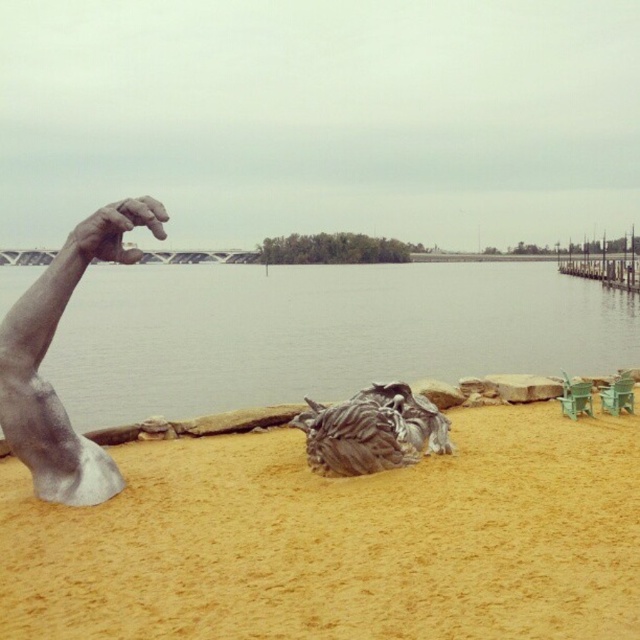
Does rough textured rock at center appear on the right side of wooden dock at right?

Incorrect, rough textured rock at center is not on the right side of wooden dock at right.

Consider the image. Can you confirm if rough textured rock at center is positioned to the left of wooden dock at right?

Yes, rough textured rock at center is to the left of wooden dock at right.

Does point (444, 433) come farther from viewer compared to point (564, 269)?

No, it is in front of (564, 269).

I want to click on rough textured rock at center, so click(372, 429).

Is silver metallic hand at upper left thinner than wooden dock at right?

Correct, silver metallic hand at upper left's width is less than wooden dock at right's.

You are a GUI agent. You are given a task and a screenshot of the screen. Output one action in this format:
    pyautogui.click(x=<x>, y=<y>)
    Task: Click on the silver metallic hand at upper left
    
    Given the screenshot: What is the action you would take?
    pyautogui.click(x=115, y=230)

Find the location of a particular element. silver metallic hand at upper left is located at coordinates (115, 230).

Between silver metallic arm at left and rough textured rock at center, which one has more height?

With more height is silver metallic arm at left.

Is silver metallic arm at left to the left of rough textured rock at center from the viewer's perspective?

Correct, you'll find silver metallic arm at left to the left of rough textured rock at center.

Is point (49, 317) positioned after point (332, 417)?

No.

Find the location of `silver metallic arm at left`. silver metallic arm at left is located at coordinates (45, 352).